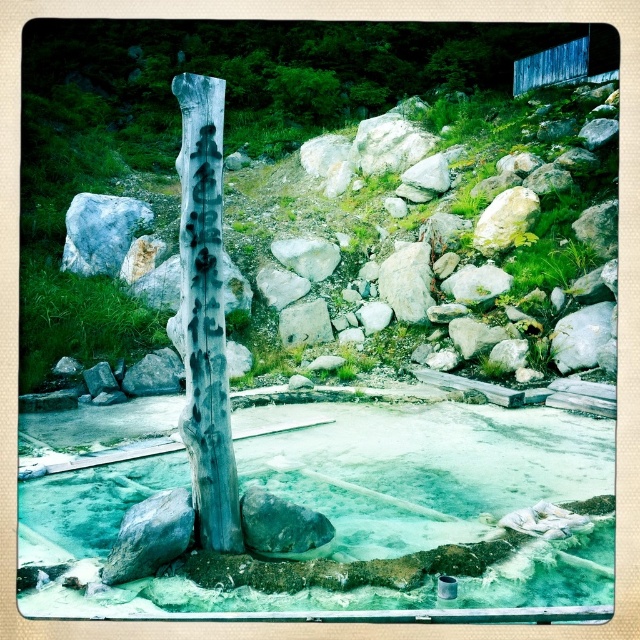
You are standing at the wooden post with Japanese characters and looking towards the hot spring. There are two points marked in the image. Which point, point [188,262] or point [113,275], is closer to you?

Point [188,262] is in front of point [113,275], so it is closer to you.